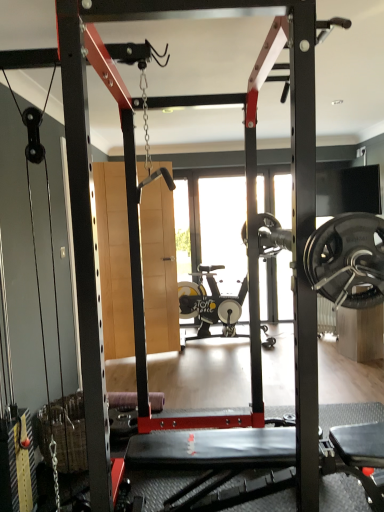
The width and height of the screenshot is (384, 512). What do you see at coordinates (114, 259) in the screenshot?
I see `wooden at center` at bounding box center [114, 259].

I want to click on wooden at center, so click(x=114, y=259).

I want to click on wooden at center, so click(x=114, y=259).